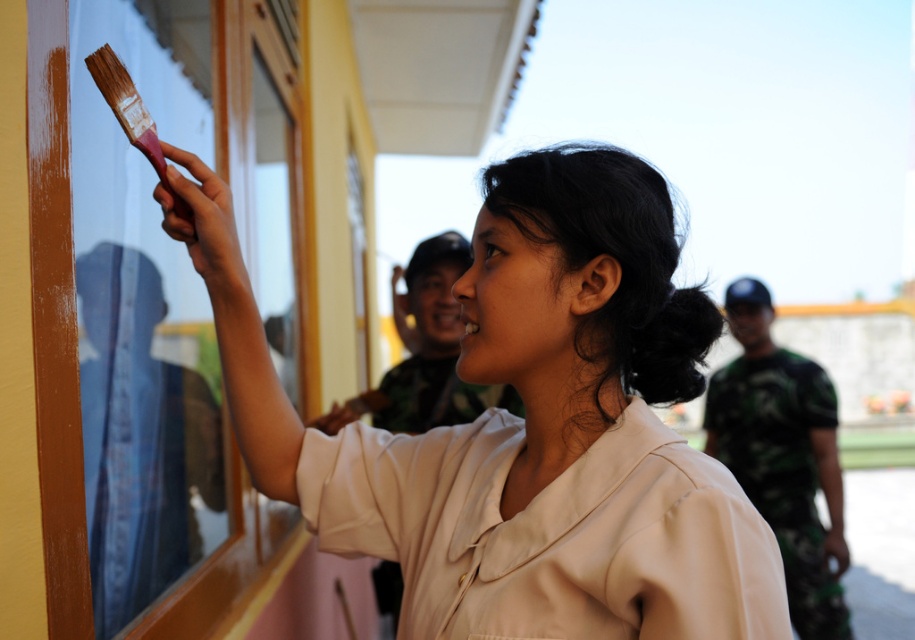
In the scene shown: You are standing in front of the wall where the girl is painting. There are two points marked on the wall at coordinates point (346, 417) and point (127, 138). If you want to touch the point that is closer to you, which one should you choose?

You should choose point (127, 138) because it is closer to you than point (346, 417), which is further away.

You are a painter who needs to reach the pink wooden paintbrush at upper left before the matte beige shirt at upper center. Which object should you reach for first?

The pink wooden paintbrush at upper left should be reached for first since it is located above the matte beige shirt at upper center, making it closer to your hand.